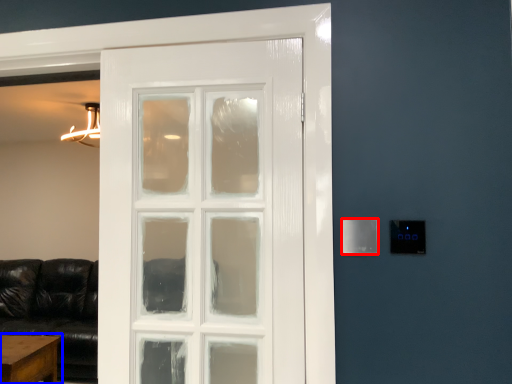
Question: Among these objects, which one is farthest to the camera, light switch (highlighted by a red box) or table (highlighted by a blue box)?

Choices:
 (A) light switch
 (B) table

Answer: (B)